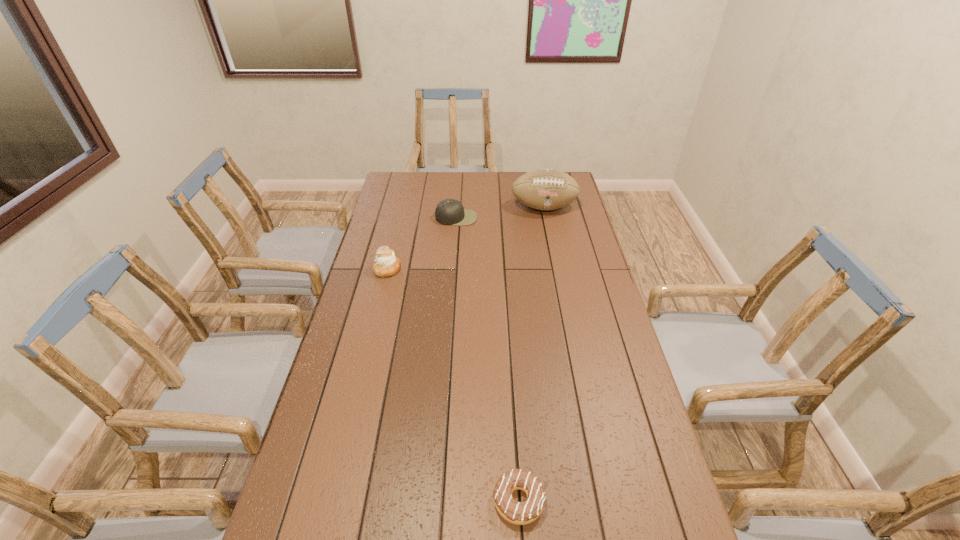
Where is `the tallest object`? Image resolution: width=960 pixels, height=540 pixels. the tallest object is located at coordinates point(546,189).

At what (x,y) coordinates should I click in order to perform the action: click on pastry. Please return your answer as a coordinate pair (x, y). Looking at the image, I should click on (386, 264).

The height and width of the screenshot is (540, 960). Find the location of `the leftmost object`. the leftmost object is located at coordinates (386, 264).

The height and width of the screenshot is (540, 960). I want to click on cap, so click(x=449, y=211).

This screenshot has width=960, height=540. What are the coordinates of `the nearest object` in the screenshot? It's located at (520, 513).

What are the coordinates of `the shortest object` in the screenshot? It's located at (520, 513).

At what (x,y) coordinates should I click in order to perform the action: click on vacant position located on the laces of the football (American). Please return your answer as a coordinate pair (x, y). Looking at the image, I should click on (552, 247).

The width and height of the screenshot is (960, 540). I want to click on vacant area located on the front of the third farthest object, so (x=377, y=310).

Where is `vacant space positioned on the brim of the cap`? vacant space positioned on the brim of the cap is located at coordinates (453, 264).

You are a GUI agent. You are given a task and a screenshot of the screen. Output one action in this format:
    pyautogui.click(x=<x>, y=<y>)
    Task: Click on the vacant point located 0.390m on the left of the nearest object
    The image size is (960, 540).
    Given the screenshot: What is the action you would take?
    pyautogui.click(x=324, y=501)